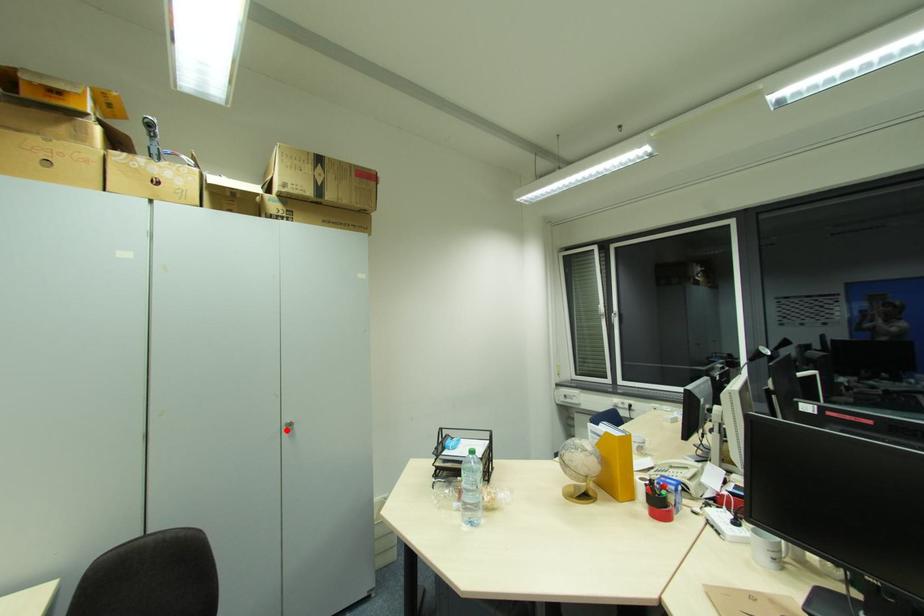
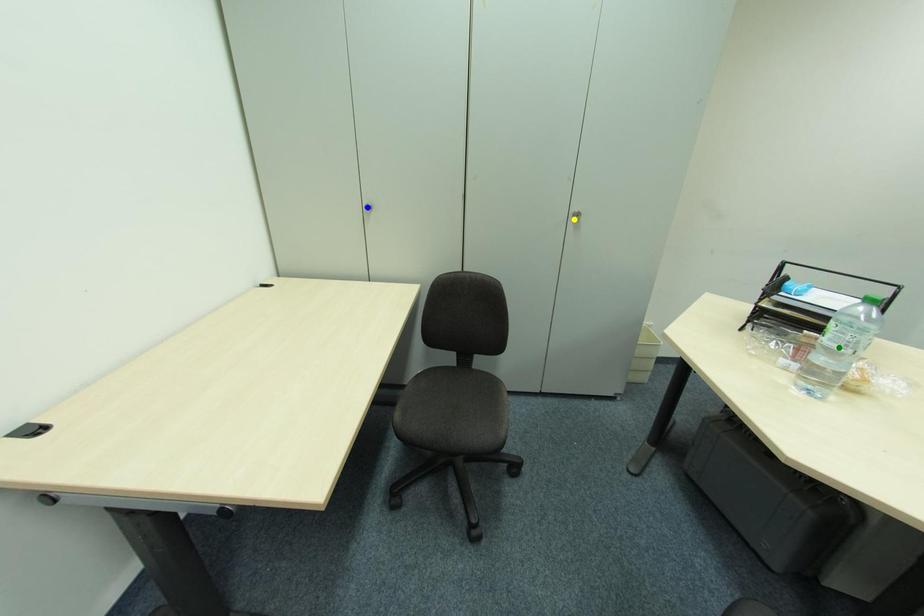
Question: I am providing you with two images of the same scene from different viewpoints. A red point is marked on the first image. You are given multiple points on the second image. Which spot in image 2 lines up with the point in image 1?

Choices:
 (A) yellow point
 (B) blue point
 (C) green point

Answer: (A)